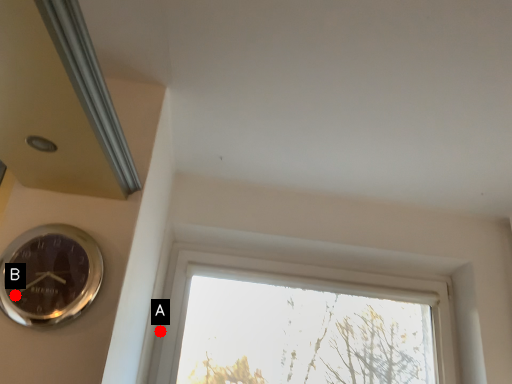
Question: Two points are circled on the image, labeled by A and B beside each circle. Which point is closer to the camera?

Choices:
 (A) A is closer
 (B) B is closer

Answer: (B)